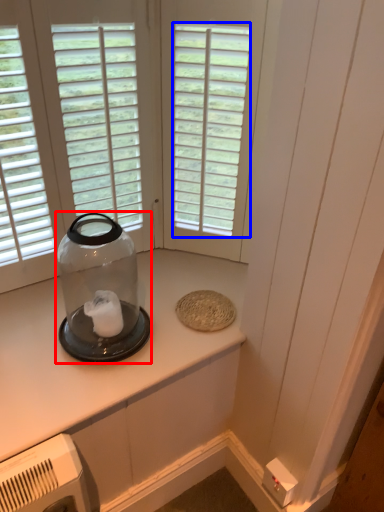
Question: Among these objects, which one is farthest to the camera, glass bottle (highlighted by a red box) or window (highlighted by a blue box)?

Choices:
 (A) glass bottle
 (B) window

Answer: (B)